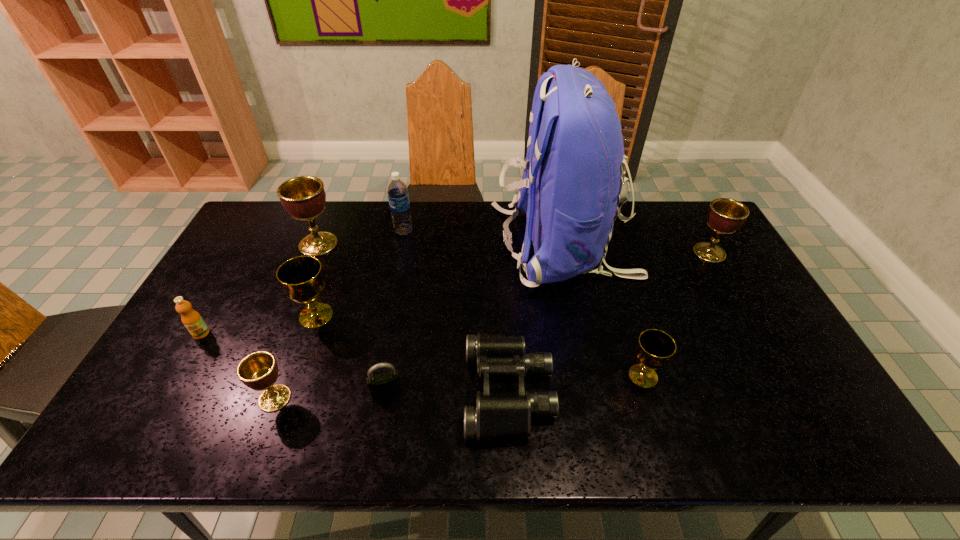
Image resolution: width=960 pixels, height=540 pixels. I want to click on backpack, so click(x=573, y=181).

Image resolution: width=960 pixels, height=540 pixels. I want to click on blue backpack, so [x=573, y=181].

Identify the location of water bottle. (398, 196).

Find the location of a particular element. This screenshot has width=960, height=540. the biggest golden chalice is located at coordinates (303, 197).

Locate an element on the screen. Image resolution: width=960 pixels, height=540 pixels. the rightmost object is located at coordinates (725, 216).

Find the location of a particular element. The width and height of the screenshot is (960, 540). the second smallest golden chalice is located at coordinates (725, 216).

Identify the location of the bigger gold chalice. (301, 277).

This screenshot has width=960, height=540. In order to click on the left gold chalice in this screenshot , I will do `click(301, 277)`.

Image resolution: width=960 pixels, height=540 pixels. I want to click on the leftmost object, so click(x=192, y=320).

Identify the location of the right gold chalice. The height and width of the screenshot is (540, 960). (655, 348).